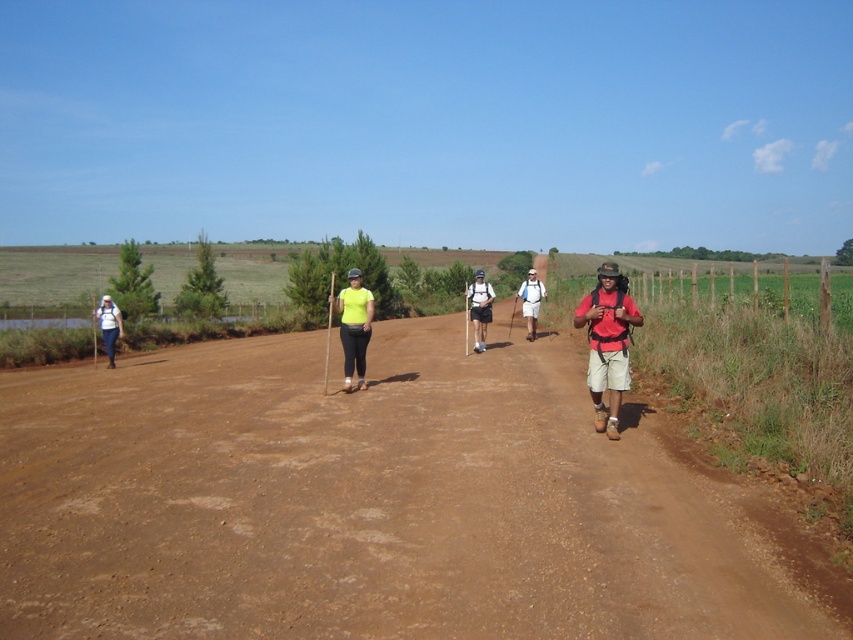
Is matte white backpack at left below matte white backpack at center?

Indeed, matte white backpack at left is positioned under matte white backpack at center.

Is matte white backpack at left behind matte white backpack at center?

That is False.

Describe the element at coordinates (108, 324) in the screenshot. The width and height of the screenshot is (853, 640). I see `matte white backpack at left` at that location.

Identify the location of matte white backpack at left. (108, 324).

Does neon yellow t-shirt at center have a greater width compared to matte white backpack at left?

Yes, neon yellow t-shirt at center is wider than matte white backpack at left.

Who is higher up, neon yellow t-shirt at center or matte white backpack at left?

Positioned higher is neon yellow t-shirt at center.

Is point (340, 317) positioned in front of point (114, 330)?

That is False.

This screenshot has width=853, height=640. In order to click on neon yellow t-shirt at center in this screenshot , I will do `click(352, 326)`.

How much distance is there between matte black backpack at center and matte white backpack at left?

matte black backpack at center and matte white backpack at left are 29.98 feet apart.

Between matte black backpack at center and matte white backpack at left, which one is positioned higher?

matte black backpack at center

Is point (473, 285) positioned after point (109, 333)?

No, it is not.

Identify the location of matte black backpack at center. Image resolution: width=853 pixels, height=640 pixels. (479, 307).